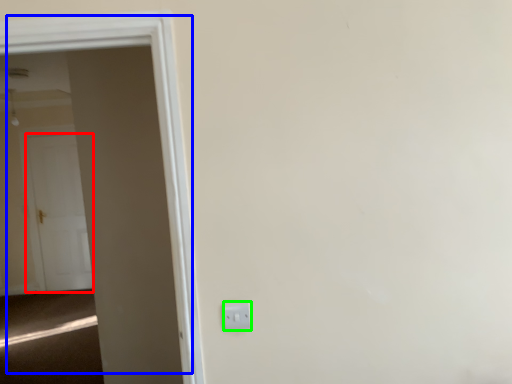
Question: Considering the real-world distances, which object is farthest from door (highlighted by a red box)? door (highlighted by a blue box) or electric outlet (highlighted by a green box)?

Choices:
 (A) door
 (B) electric outlet

Answer: (B)